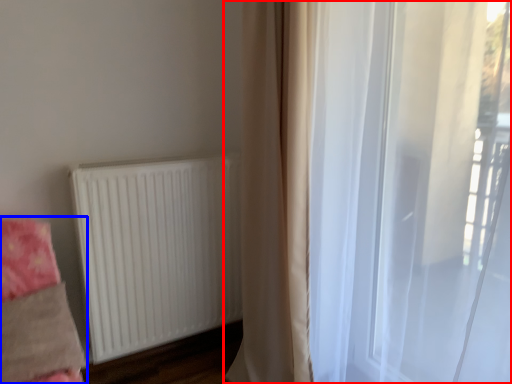
Question: Which object appears farthest to the camera in this image, curtain (highlighted by a red box) or bedding (highlighted by a blue box)?

Choices:
 (A) curtain
 (B) bedding

Answer: (B)